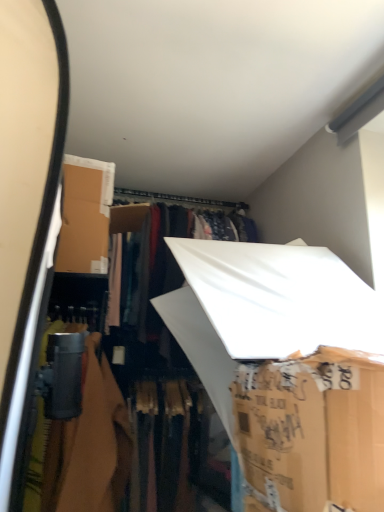
Question: In terms of height, does white cardboard box at center, which is the 2th storage box from front to back, look taller or shorter compared to white cardboard box at lower right, acting as the 2th storage box starting from the back?

Choices:
 (A) tall
 (B) short

Answer: (A)

Question: From the image's perspective, is white cardboard box at center, which is the 2th storage box from front to back, located above or below white cardboard box at lower right, which is the first storage box in front-to-back order?

Choices:
 (A) below
 (B) above

Answer: (B)

Question: Based on their sizes in the image, would you say white cardboard box at center, which is the 2th storage box from front to back, is bigger or smaller than white cardboard box at lower right, acting as the 2th storage box starting from the back?

Choices:
 (A) small
 (B) big

Answer: (B)

Question: Considering the positions of white cardboard box at lower right, acting as the 2th storage box starting from the back, and white cardboard box at center, which is the 2th storage box from front to back, in the image, is white cardboard box at lower right, acting as the 2th storage box starting from the back, wider or thinner than white cardboard box at center, which is the 2th storage box from front to back,?

Choices:
 (A) thin
 (B) wide

Answer: (A)

Question: Is white cardboard box at lower right, acting as the 2th storage box starting from the back, inside the boundaries of white cardboard box at center, which is the 2th storage box from front to back, or outside?

Choices:
 (A) outside
 (B) inside

Answer: (A)

Question: In terms of height, does white cardboard box at lower right, which is the first storage box in front-to-back order, look taller or shorter compared to white cardboard box at center, which ranks as the 1th storage box in back-to-front order?

Choices:
 (A) short
 (B) tall

Answer: (A)

Question: From the image's perspective, is white cardboard box at lower right, which is the first storage box in front-to-back order, positioned above or below white cardboard box at center, which ranks as the 1th storage box in back-to-front order?

Choices:
 (A) below
 (B) above

Answer: (A)